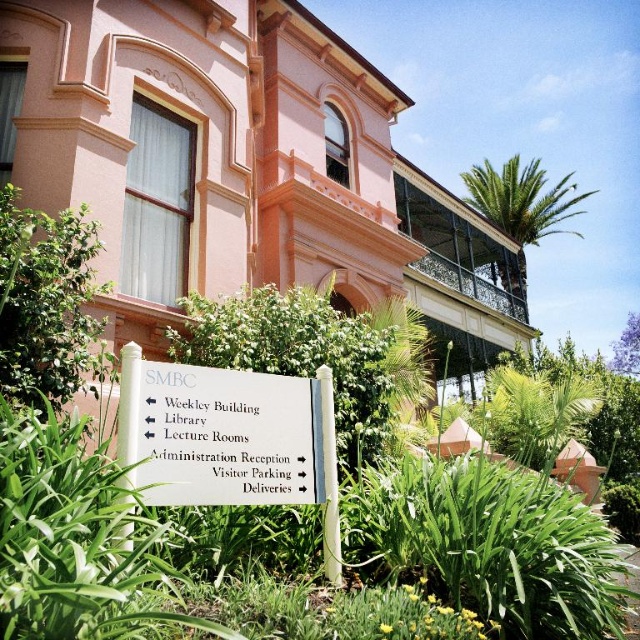
Is pink matte building at center taller than white plastic sign at center?

Yes, pink matte building at center is taller than white plastic sign at center.

Does point (179, 285) come in front of point (212, 460)?

No.

Between point (304, 202) and point (253, 426), which one is positioned behind?

Point (304, 202)

Identify the location of pink matte building at center. (241, 166).